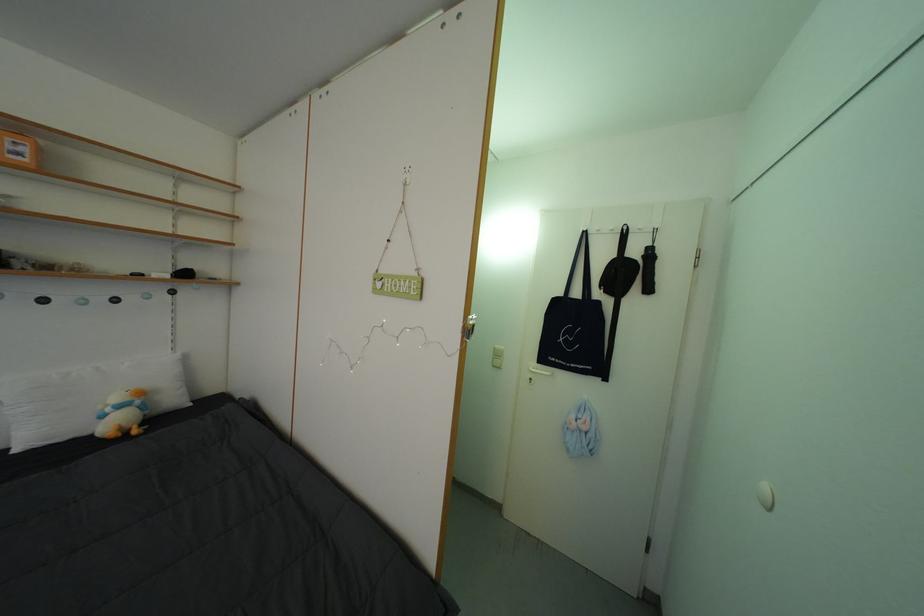
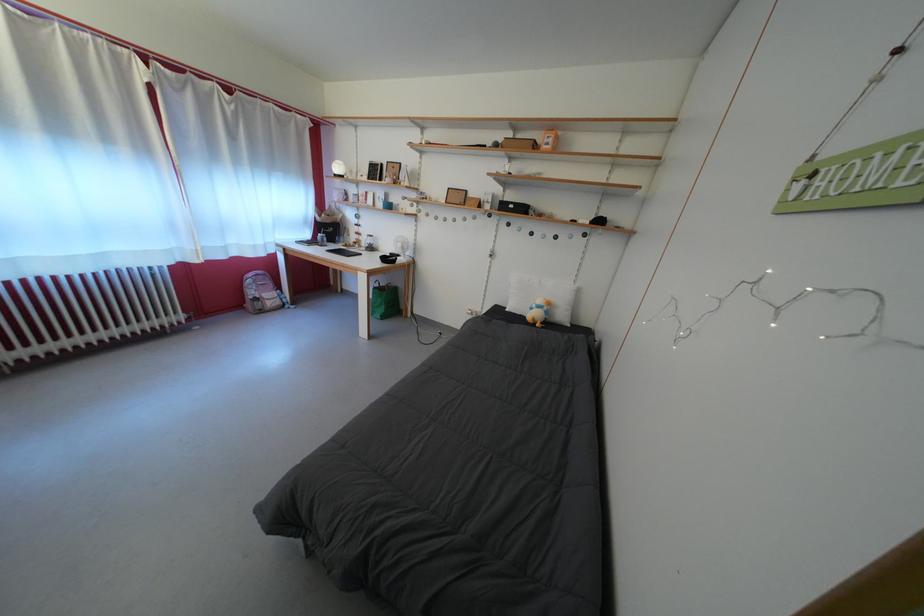
Locate, in the second image, the point that corresponds to (152,413) in the first image.

(554, 318)